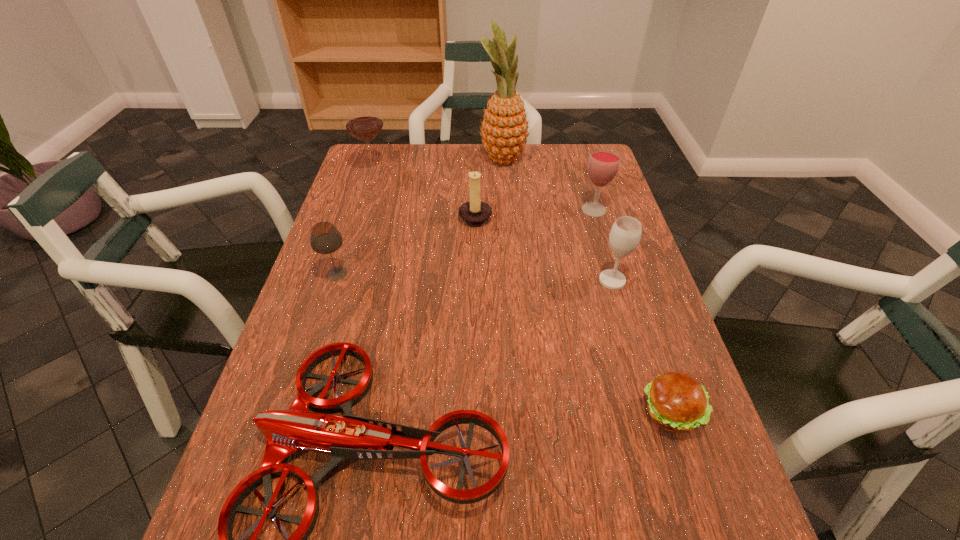
The image size is (960, 540). In order to click on the tallest object in this screenshot , I will do `click(504, 128)`.

At what (x,y) coordinates should I click in order to perform the action: click on the farthest wineglass. Please return your answer as a coordinate pair (x, y). This screenshot has width=960, height=540. Looking at the image, I should click on (363, 121).

Locate an element on the screen. the third nearest wineglass is located at coordinates (603, 165).

Image resolution: width=960 pixels, height=540 pixels. I want to click on candle holder, so click(474, 213).

Locate an element on the screen. The width and height of the screenshot is (960, 540). the shortest wineglass is located at coordinates (324, 238).

This screenshot has height=540, width=960. I want to click on hamburger, so click(x=677, y=403).

You are a GUI agent. You are given a task and a screenshot of the screen. Output one action in this format:
    pyautogui.click(x=<x>, y=<y>)
    Task: Click on the vacant space located on the front of the pineapple
    This screenshot has width=960, height=540.
    Given the screenshot: What is the action you would take?
    pyautogui.click(x=506, y=193)

Locate an element on the screen. This screenshot has width=960, height=540. free space located 0.220m on the right of the farthest wineglass is located at coordinates (459, 171).

I want to click on free space located 0.050m on the front of the second farthest wineglass, so click(600, 230).

Where is `free space located 0.190m on the wick of the candle holder`? free space located 0.190m on the wick of the candle holder is located at coordinates (559, 216).